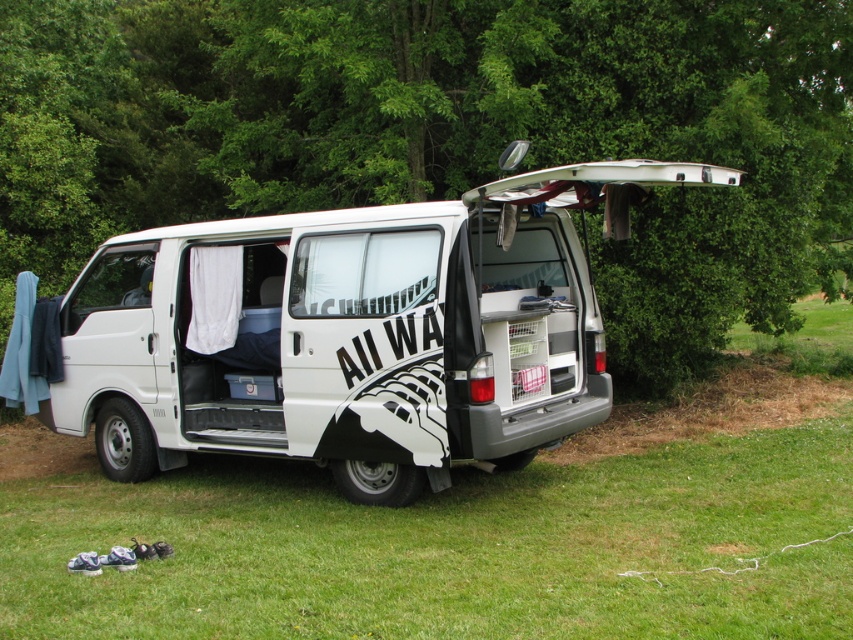
You are planning to take a road trip and need to know if the white matte van at center can fit through a narrow alley that is as wide as the green leafy tree at upper center. Can it?

The green leafy tree at upper center is wider than the white matte van at center, so the van can fit through the alley since it is narrower than the tree.

You are planning to take a road trip and need to know if the white matte van at center can fit through a narrow alley that is only as wide as the green leafy tree at upper center. Can it?

The green leafy tree at upper center is larger in size than the white matte van at center, so the van can fit through the alley since it is smaller in width than the tree.